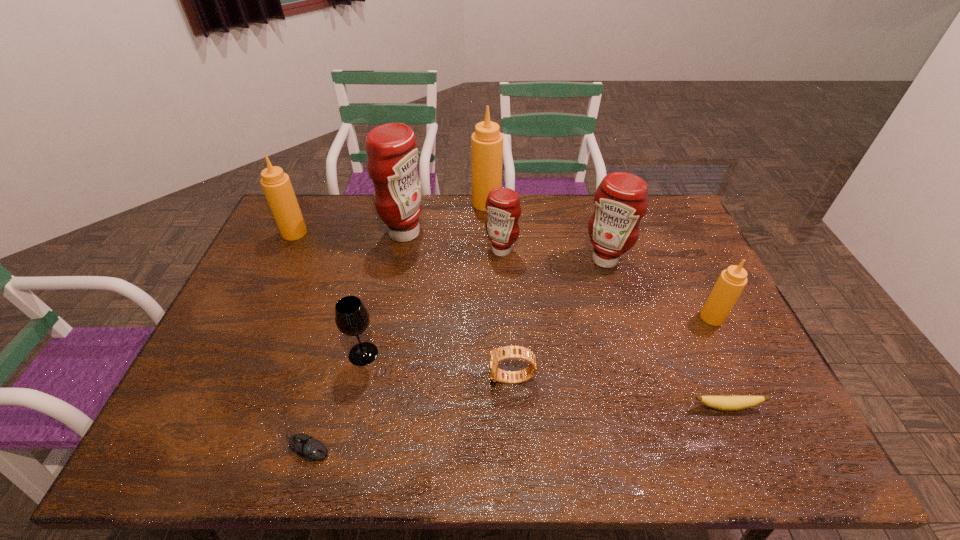
At what (x,y) coordinates should I click in order to perform the action: click on vacant area that lies between the black watch and the nearest condiment. Please return your answer as a coordinate pair (x, y). Looking at the image, I should click on (612, 348).

Find the location of a particular element. The width and height of the screenshot is (960, 540). free space between the wineglass and the rightmost tan condiment is located at coordinates (538, 335).

Locate an element on the screen. This screenshot has width=960, height=540. unoccupied position between the wineglass and the fifth nearest object is located at coordinates (538, 335).

This screenshot has height=540, width=960. I want to click on blank region between the third shortest object and the second shortest object, so click(619, 393).

I want to click on free area in between the fifth nearest object and the black watch, so click(x=612, y=348).

You are a GUI agent. You are given a task and a screenshot of the screen. Output one action in this format:
    pyautogui.click(x=<x>, y=<y>)
    Task: Click on the free point between the black watch and the biggest tan condiment
    This screenshot has width=960, height=540.
    Given the screenshot: What is the action you would take?
    pyautogui.click(x=499, y=291)

Image resolution: width=960 pixels, height=540 pixels. What are the coordinates of `empty location between the black watch and the second red condiment from right to left` in the screenshot? It's located at (507, 315).

Choose which object is the second nearest neighbor to the rightmost red condiment. Please provide its 2D coordinates. Your answer should be formatted as a tuple, i.e. [(x, y)], where the tuple contains the x and y coordinates of a point satisfying the conditions above.

[(731, 282)]

Locate which object is the third closest to the rightmost red condiment. Please provide its 2D coordinates. Your answer should be formatted as a tuple, i.e. [(x, y)], where the tuple contains the x and y coordinates of a point satisfying the conditions above.

[(487, 141)]

Identify which condiment is the third nearest to the smallest red condiment. Please provide its 2D coordinates. Your answer should be formatted as a tuple, i.e. [(x, y)], where the tuple contains the x and y coordinates of a point satisfying the conditions above.

[(621, 200)]